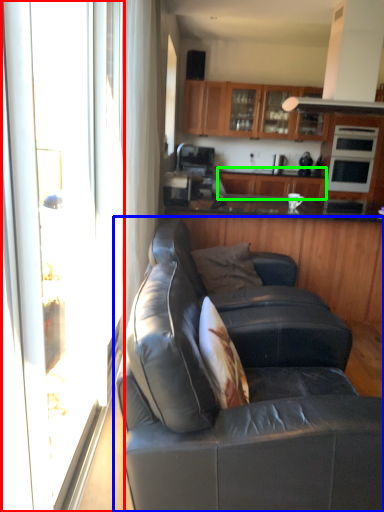
Question: Estimate the real-world distances between objects in this image. Which object is farther from screen door (highlighted by a red box), studio couch (highlighted by a blue box) or cabinetry (highlighted by a green box)?

Choices:
 (A) studio couch
 (B) cabinetry

Answer: (B)